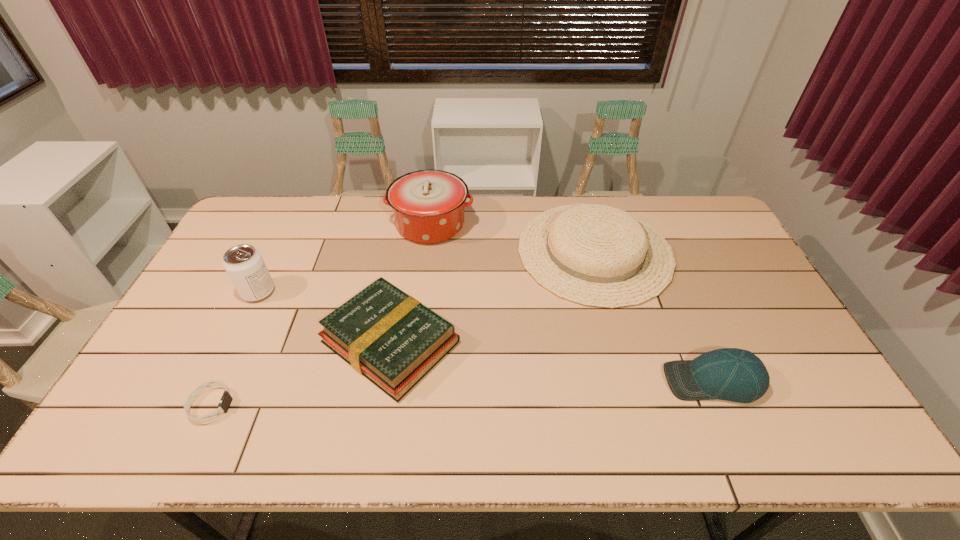
The width and height of the screenshot is (960, 540). Identify the location of vacant area situated on the right of the hardback book. (515, 342).

This screenshot has width=960, height=540. Find the location of `vacant space located 0.340m on the outer surface of the shortest object`. vacant space located 0.340m on the outer surface of the shortest object is located at coordinates (369, 406).

Locate an element on the screen. Image resolution: width=960 pixels, height=540 pixels. casserole located at the far edge is located at coordinates (428, 205).

This screenshot has width=960, height=540. Identify the location of sunhat at the far edge. (595, 255).

The width and height of the screenshot is (960, 540). Identify the location of object located at the near edge. (226, 399).

Identify the location of soda can that is at the left edge. (243, 263).

Locate an element on the screen. wristband that is at the left edge is located at coordinates (226, 399).

Find the location of a particular element. The height and width of the screenshot is (540, 960). object at the right edge is located at coordinates (731, 374).

Image resolution: width=960 pixels, height=540 pixels. I want to click on object located at the near left corner, so (226, 399).

This screenshot has height=540, width=960. What are the coordinates of `blank area at the far edge` in the screenshot? It's located at (371, 226).